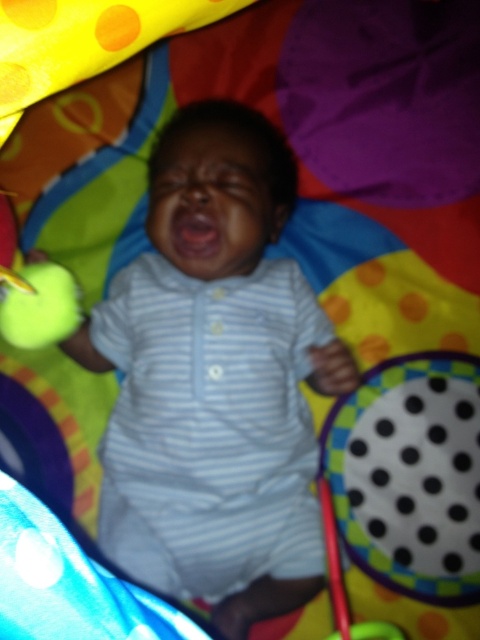
Question: Is white striped onesie at center behind green rubber ball at left?

Choices:
 (A) yes
 (B) no

Answer: (B)

Question: Which object is farther from the camera taking this photo?

Choices:
 (A) white striped onesie at center
 (B) green rubber ball at left

Answer: (B)

Question: Among these points, which one is nearest to the camera?

Choices:
 (A) (24, 264)
 (B) (262, 346)

Answer: (B)

Question: Can you confirm if white striped onesie at center is thinner than green rubber ball at left?

Choices:
 (A) yes
 (B) no

Answer: (B)

Question: Does white striped onesie at center have a greater width compared to green rubber ball at left?

Choices:
 (A) no
 (B) yes

Answer: (B)